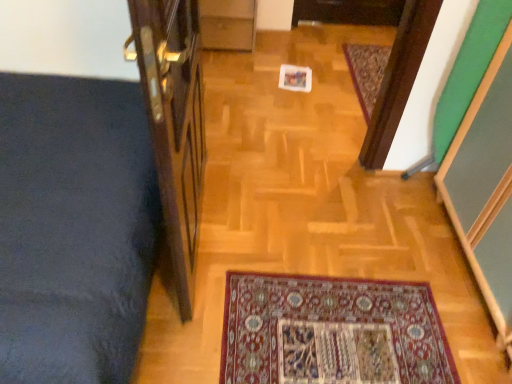
Find the location of `free space to the left of carpeted mat at center`. free space to the left of carpeted mat at center is located at coordinates (295, 66).